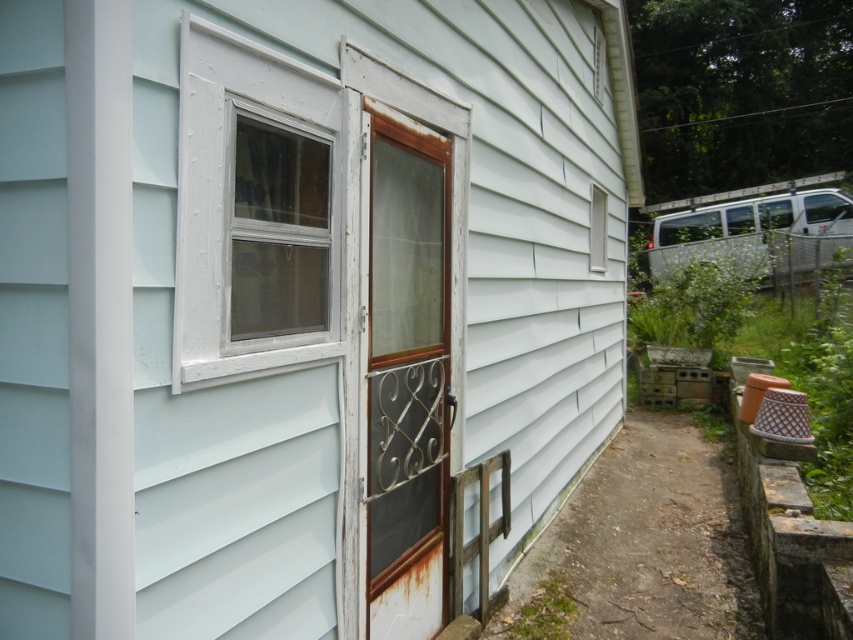
Question: Does light blue siding at center appear under rusty metal screen door at center?

Choices:
 (A) yes
 (B) no

Answer: (B)

Question: Considering the real-world distances, which object is farthest from the clear glass window at upper left?

Choices:
 (A) light blue siding at center
 (B) rusty metal screen door at center

Answer: (B)

Question: Estimate the real-world distances between objects in this image. Which object is farther from the light blue siding at center?

Choices:
 (A) white plastic window at upper left
 (B) rusty metal screen door at center

Answer: (A)

Question: Is light blue siding at center above rusty metal screen door at center?

Choices:
 (A) yes
 (B) no

Answer: (A)

Question: Does white plastic window at upper left have a smaller size compared to clear glass window at upper left?

Choices:
 (A) no
 (B) yes

Answer: (A)

Question: Estimate the real-world distances between objects in this image. Which object is farther from the light blue siding at center?

Choices:
 (A) clear glass window at upper left
 (B) rusty metal screen door at center
 (C) white plastic window at upper left

Answer: (A)